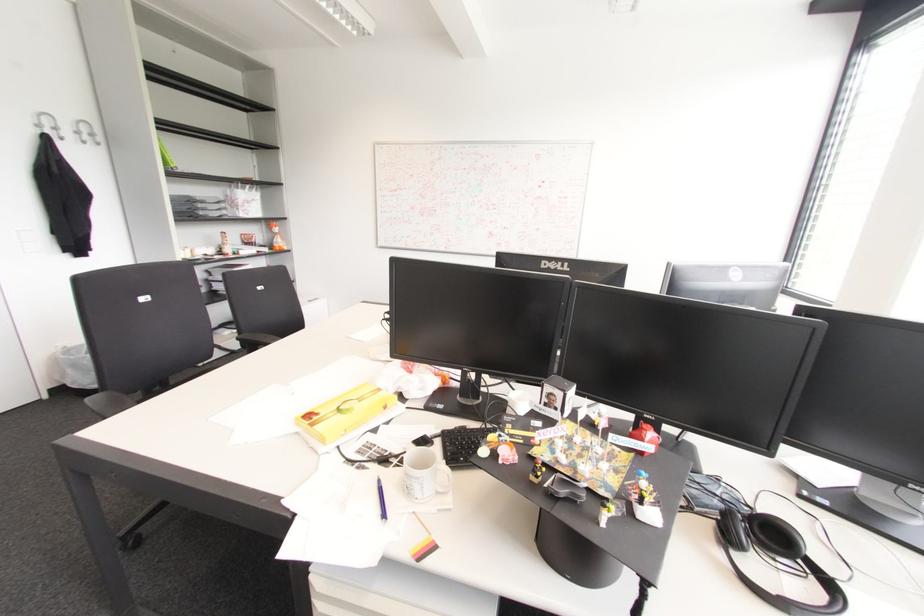
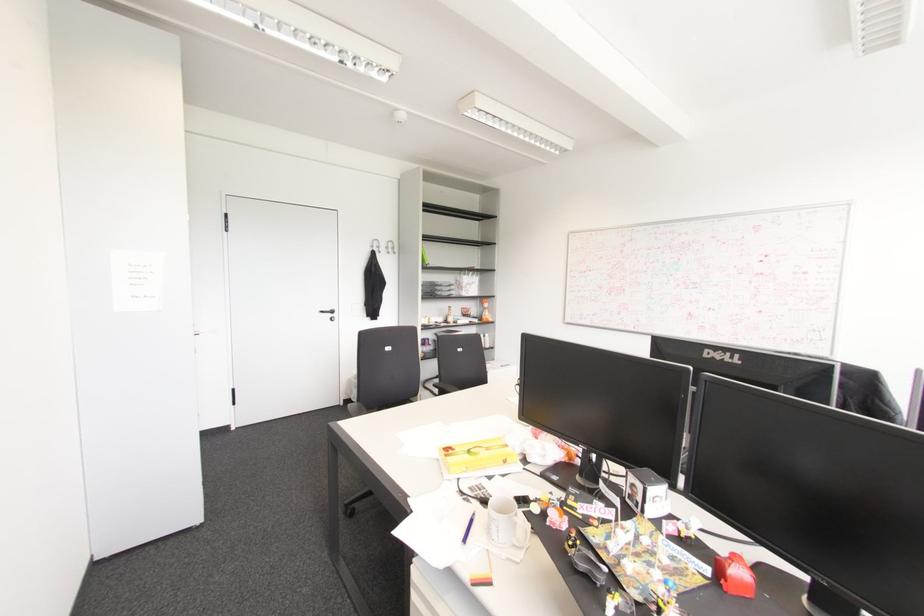
Find the pixel in the second image that matches [650,436] in the first image.

(740, 570)